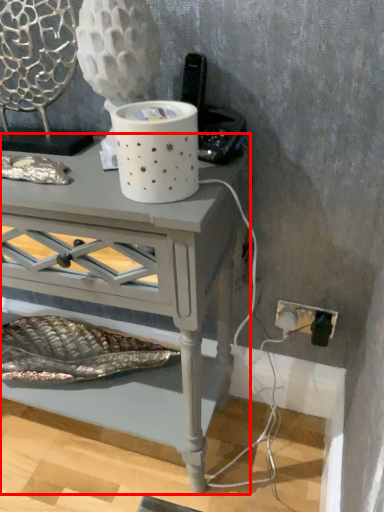
Question: From the image's perspective, what is the correct spatial relationship of table (annotated by the red box) in relation to swivel chair?

Choices:
 (A) above
 (B) below

Answer: (B)